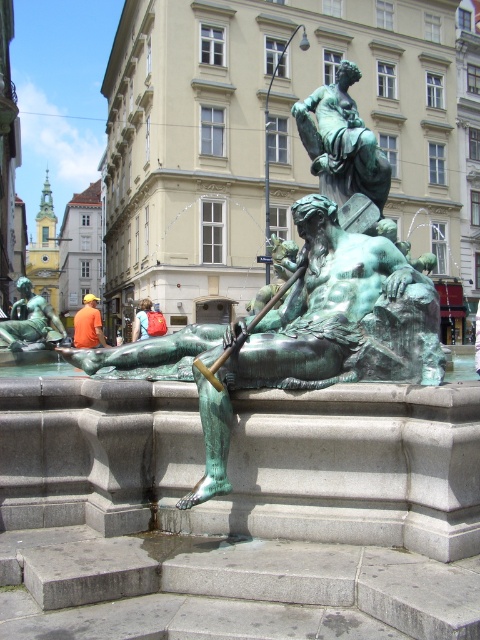
Looking at this image, you are standing in front of the bronze fountain sculpture in the plaza. You see an orange fabric shirt at center and an orange fabric bag at center. Which one is positioned to the left?

The orange fabric shirt at center is positioned to the left of the orange fabric bag at center.